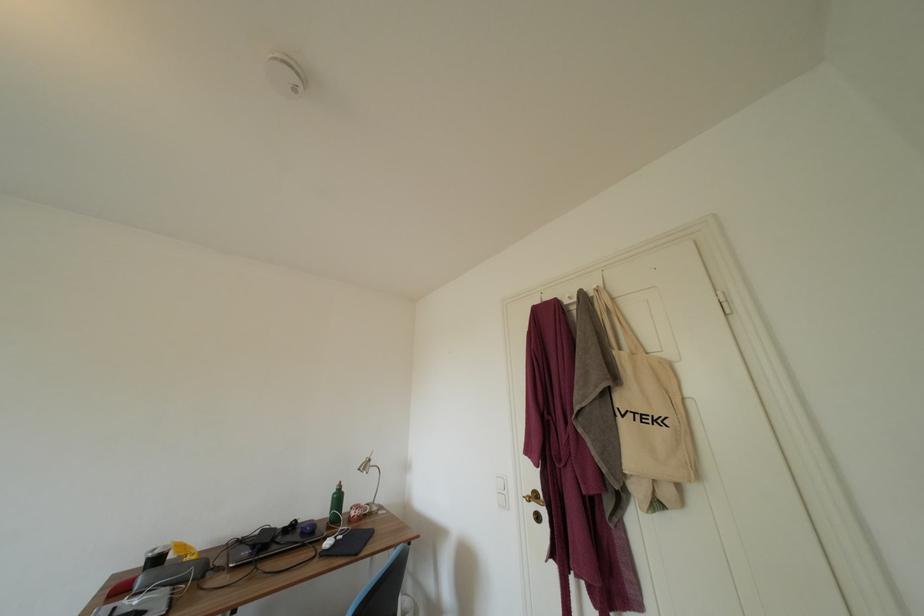
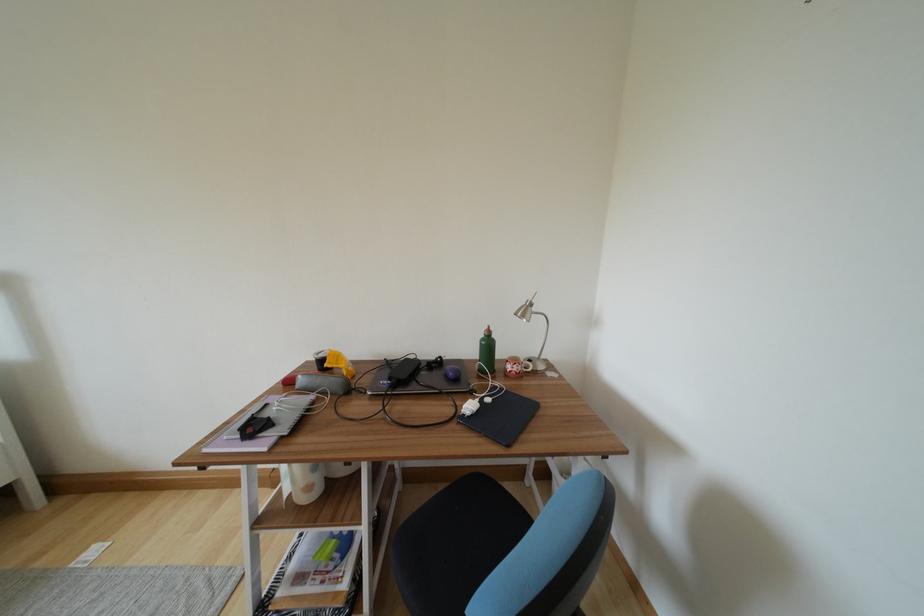
The point at (258,551) is marked in the first image. Where is the corresponding point in the second image?

(395, 382)